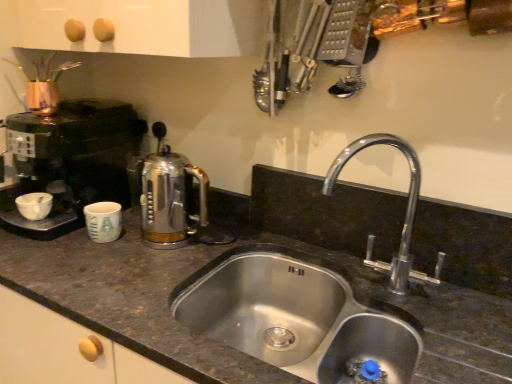
Question: Is stainless steel sink at center thinner than chrome metallic faucet at center right?

Choices:
 (A) yes
 (B) no

Answer: (B)

Question: Is stainless steel sink at center further to camera compared to chrome metallic faucet at center right?

Choices:
 (A) no
 (B) yes

Answer: (A)

Question: From a real-world perspective, is stainless steel sink at center physically below chrome metallic faucet at center right?

Choices:
 (A) yes
 (B) no

Answer: (A)

Question: Can you confirm if stainless steel sink at center is positioned to the right of chrome metallic faucet at center right?

Choices:
 (A) no
 (B) yes

Answer: (A)

Question: From the image's perspective, does stainless steel sink at center appear higher than chrome metallic faucet at center right?

Choices:
 (A) no
 (B) yes

Answer: (A)

Question: Can you confirm if stainless steel sink at center is wider than chrome metallic faucet at center right?

Choices:
 (A) yes
 (B) no

Answer: (A)

Question: Considering the relative sizes of chrome metallic faucet at center right and satin chrome coffee pot at center in the image provided, is chrome metallic faucet at center right smaller than satin chrome coffee pot at center?

Choices:
 (A) yes
 (B) no

Answer: (B)

Question: From a real-world perspective, is chrome metallic faucet at center right on satin chrome coffee pot at center?

Choices:
 (A) no
 (B) yes

Answer: (B)

Question: Is the surface of chrome metallic faucet at center right in direct contact with satin chrome coffee pot at center?

Choices:
 (A) yes
 (B) no

Answer: (B)

Question: Is chrome metallic faucet at center right at the right side of satin chrome coffee pot at center?

Choices:
 (A) no
 (B) yes

Answer: (B)

Question: Is chrome metallic faucet at center right in front of satin chrome coffee pot at center?

Choices:
 (A) yes
 (B) no

Answer: (A)

Question: Is chrome metallic faucet at center right to the left of satin chrome coffee pot at center from the viewer's perspective?

Choices:
 (A) yes
 (B) no

Answer: (B)

Question: Considering the relative sizes of satin chrome coffee pot at center and white glossy bowl at left in the image provided, is satin chrome coffee pot at center bigger than white glossy bowl at left?

Choices:
 (A) yes
 (B) no

Answer: (A)